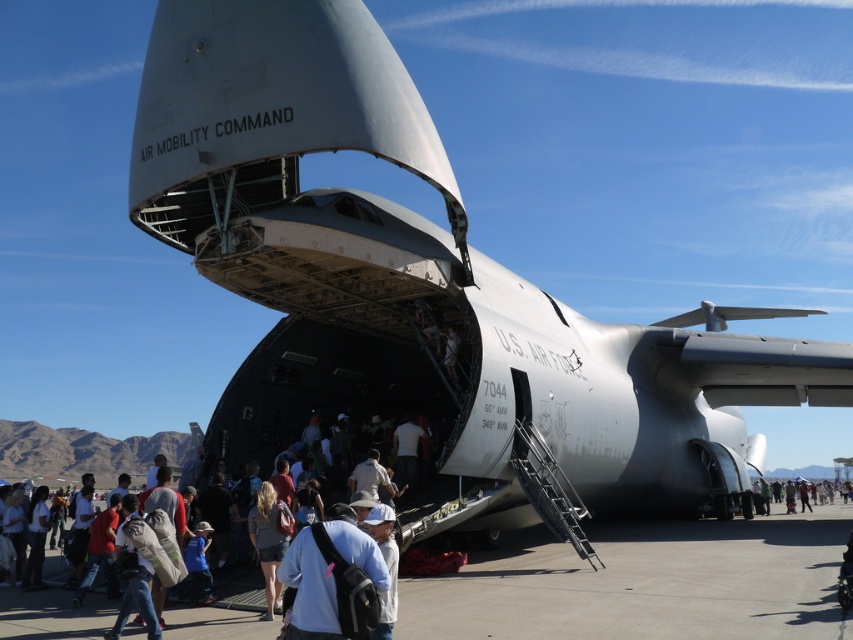
You are a maintenance technician standing on the gray concrete tarmac at lower center. You need to inspect the white fabric crowd at center. Which direction should you move to reach it?

You should move to the left to reach the white fabric crowd at center because the gray concrete tarmac at lower center is to the right of it.

You are a maintenance technician standing at the rear of the C5 Galaxy aircraft. You need to inspect two points on the aircraft. The first point is at coordinate point (440, 612) and the second point is at coordinate point (364, 532). Which point is closer to the rear doors of the aircraft?

Point (364, 532) is closer to the rear doors of the aircraft since it is in front of point (440, 612), which is behind it.